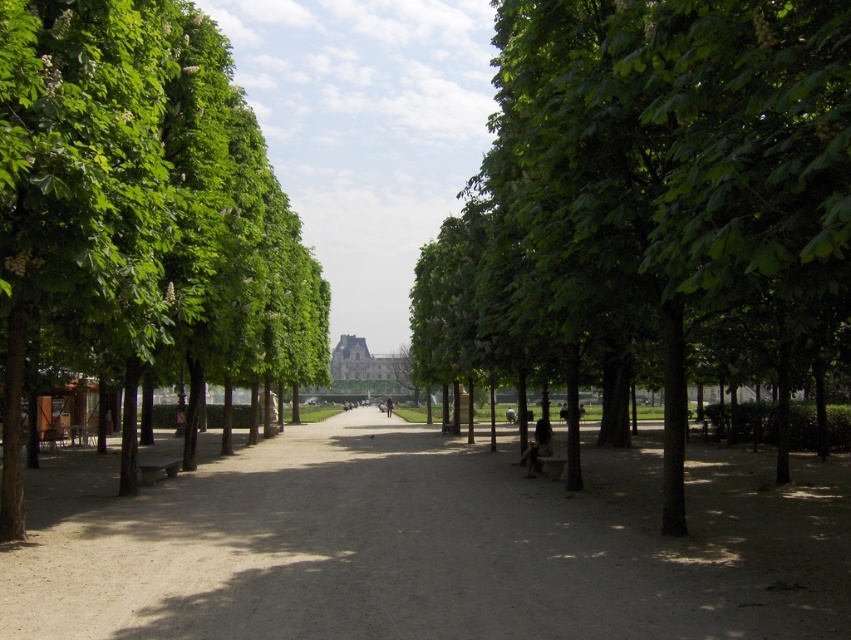
Question: Which point appears farthest from the camera in this image?

Choices:
 (A) [155, 294]
 (B) [497, 486]
 (C) [603, 163]

Answer: (B)

Question: Which of the following is the farthest from the observer?

Choices:
 (A) dirt path at center
 (B) green leafy tree at left
 (C) green leafy tree at center

Answer: (B)

Question: Which point is closer to the camera?

Choices:
 (A) dirt path at center
 (B) green leafy tree at left
 (C) green leafy tree at center

Answer: (C)

Question: Does green leafy tree at center have a smaller size compared to green leafy tree at left?

Choices:
 (A) yes
 (B) no

Answer: (A)

Question: From the image, what is the correct spatial relationship of dirt path at center in relation to green leafy tree at center?

Choices:
 (A) below
 (B) above

Answer: (A)

Question: Does dirt path at center appear on the right side of green leafy tree at left?

Choices:
 (A) yes
 (B) no

Answer: (A)